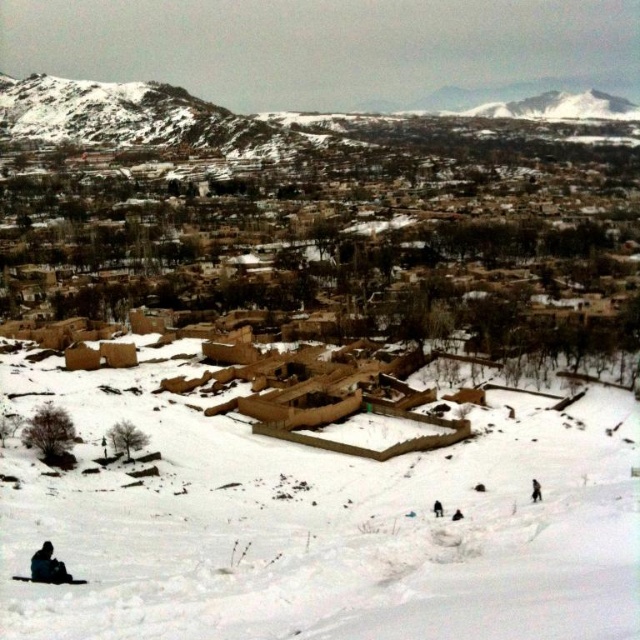
Question: Can you confirm if dark fabric figure at lower left is wider than black fabric person at lower center?

Choices:
 (A) yes
 (B) no

Answer: (A)

Question: Does brown mud-brick village at center have a larger size compared to black fabric person at lower center?

Choices:
 (A) yes
 (B) no

Answer: (A)

Question: Which object appears farthest from the camera in this image?

Choices:
 (A) dark fabric figure at lower left
 (B) black fabric person at lower center
 (C) brown mud-brick village at center
 (D) brown fur coat at lower right

Answer: (C)

Question: Which point appears closest to the camera in this image?

Choices:
 (A) click(x=440, y=512)
 (B) click(x=634, y=275)
 (C) click(x=536, y=480)

Answer: (A)

Question: Does brown mud-brick village at center have a larger size compared to black fabric person at lower center?

Choices:
 (A) yes
 (B) no

Answer: (A)

Question: Which point is farther from the camera taking this photo?

Choices:
 (A) (243, 220)
 (B) (538, 486)
 (C) (436, 509)

Answer: (A)